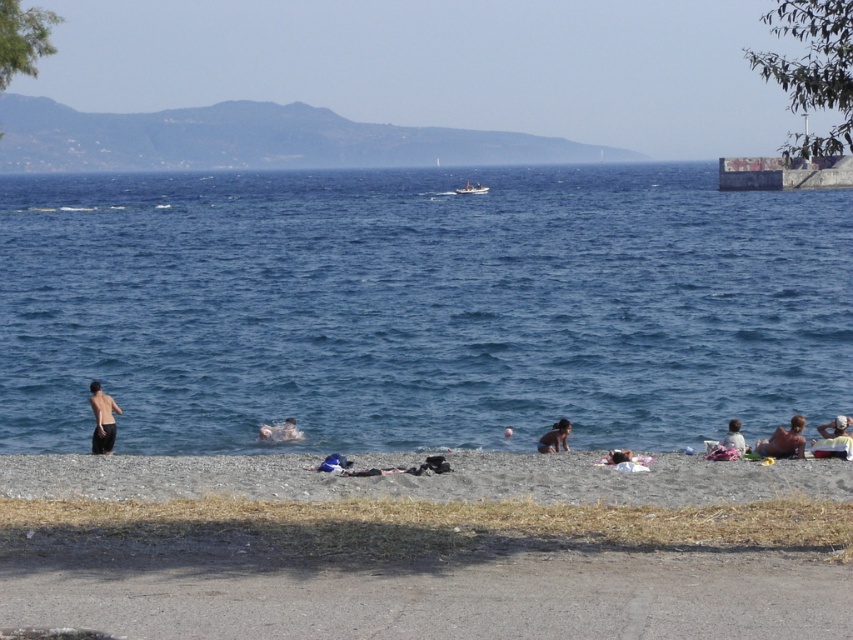
Between blue water at lower left and beige fabric towel at lower right, which one is positioned lower?

beige fabric towel at lower right is below.

Is point (190, 330) positioned in front of point (724, 452)?

No.

At what (x,y) coordinates should I click in order to perform the action: click on blue water at lower left. Please return your answer as a coordinate pair (x, y). This screenshot has height=640, width=853. Looking at the image, I should click on (418, 307).

Is point (546, 442) in front of point (292, 440)?

Yes, point (546, 442) is in front of point (292, 440).

Measure the distance from smooth skin person at center to white fabric at lower center.

18.11 feet

The image size is (853, 640). Find the location of `smooth skin person at center`. smooth skin person at center is located at coordinates (554, 436).

Is point (112, 420) more distant than point (543, 438)?

No, (112, 420) is closer to viewer.

Can you confirm if smooth skin torso at lower left is positioned to the left of smooth skin person at center?

Indeed, smooth skin torso at lower left is positioned on the left side of smooth skin person at center.

Is point (102, 442) positioned behind point (556, 428)?

No, it is not.

Where is `smooth skin torso at lower left`? The width and height of the screenshot is (853, 640). smooth skin torso at lower left is located at coordinates (102, 419).